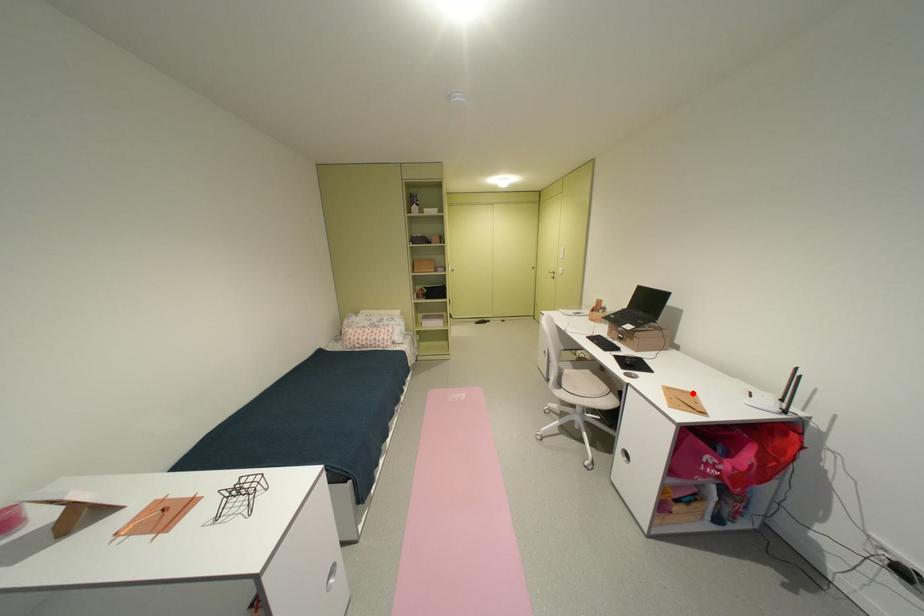
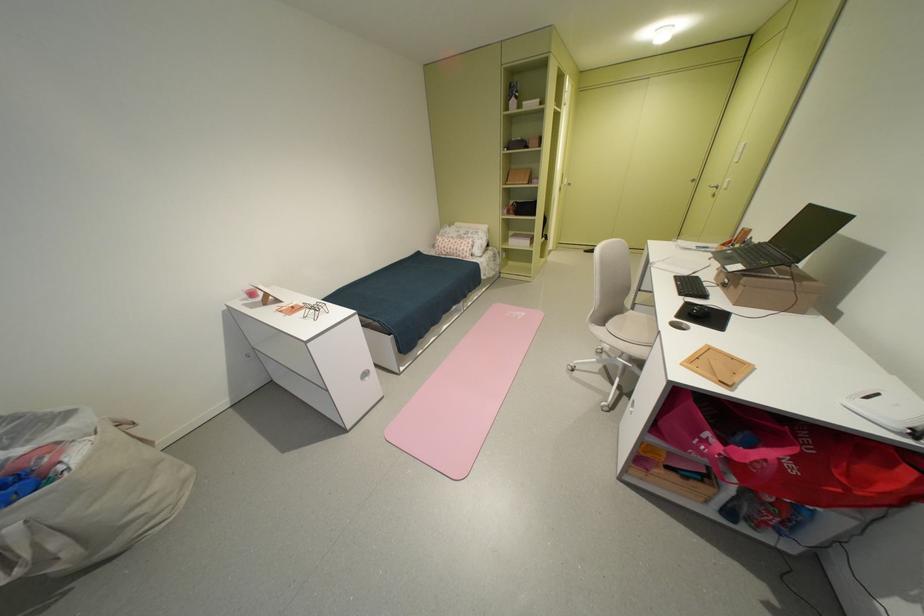
Locate, in the second image, the point that corresponds to the highlighted location in the first image.

(743, 360)